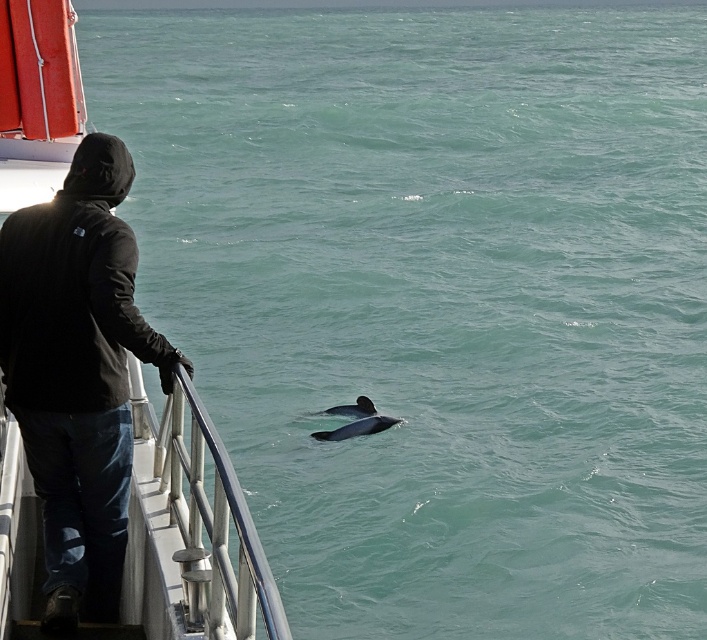
Does metallic boat at left appear on the right side of gray smooth dolphin at center?

In fact, metallic boat at left is to the left of gray smooth dolphin at center.

Identify the location of metallic boat at left. (105, 371).